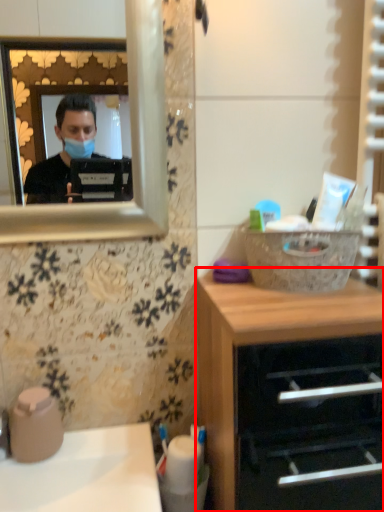
Question: Where is chest of drawers (annotated by the red box) located in relation to sink in the image?

Choices:
 (A) right
 (B) left

Answer: (A)